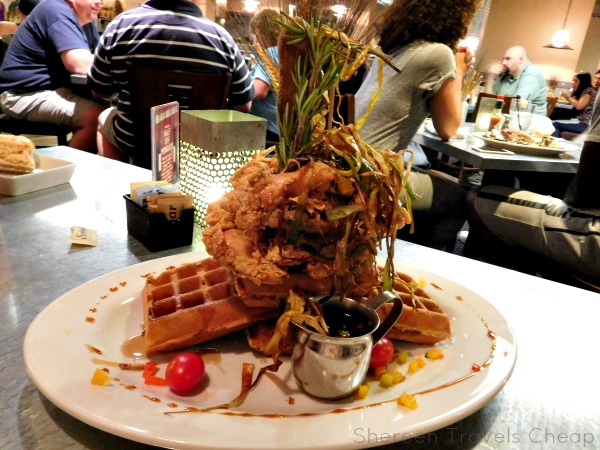
I want to click on white plate, so click(x=480, y=135), click(x=473, y=313), click(x=43, y=175).